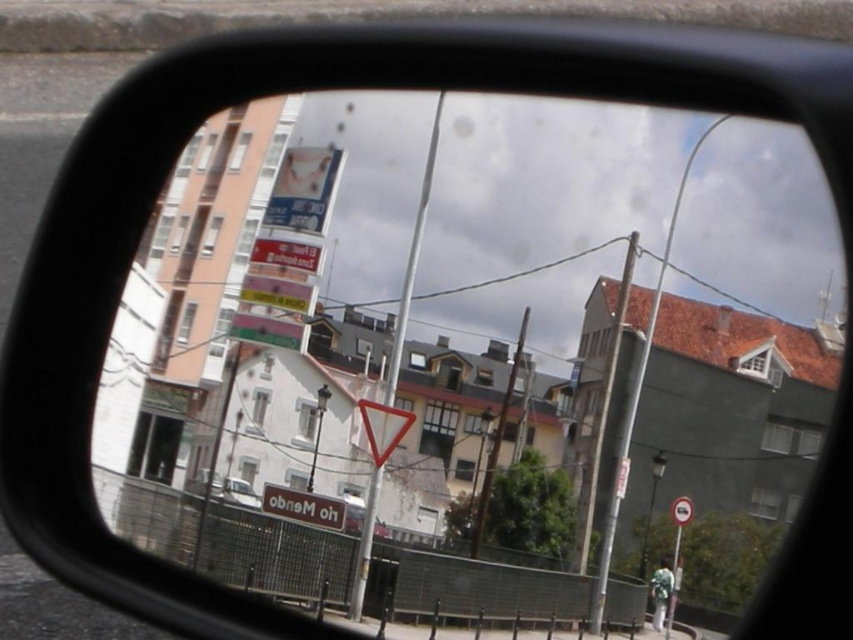
Question: Among these objects, which one is nearest to the camera?

Choices:
 (A) metallic silver car at center
 (B) white plastic traffic sign at center

Answer: (B)

Question: Can you confirm if white plastic traffic sign at center is positioned above metallic silver car at center?

Choices:
 (A) yes
 (B) no

Answer: (A)

Question: Is white plastic traffic sign at center wider than metallic silver car at center?

Choices:
 (A) yes
 (B) no

Answer: (A)

Question: Which point is closer to the camera?

Choices:
 (A) (270, 484)
 (B) (363, 504)

Answer: (A)

Question: Is white plastic traffic sign at center positioned before metallic silver car at center?

Choices:
 (A) yes
 (B) no

Answer: (A)